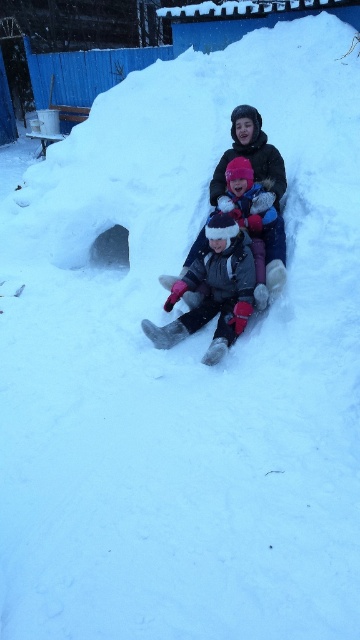
You are a photographer trying to capture both the gray woolen hat at center and the fluffy pink hat at center in a single frame. Since the camera can only focus on one hat at a time, which hat should you choose to ensure the larger one is in focus?

The gray woolen hat at center is larger than the fluffy pink hat at center, so you should focus on the gray woolen hat at center to ensure the larger one is in focus.